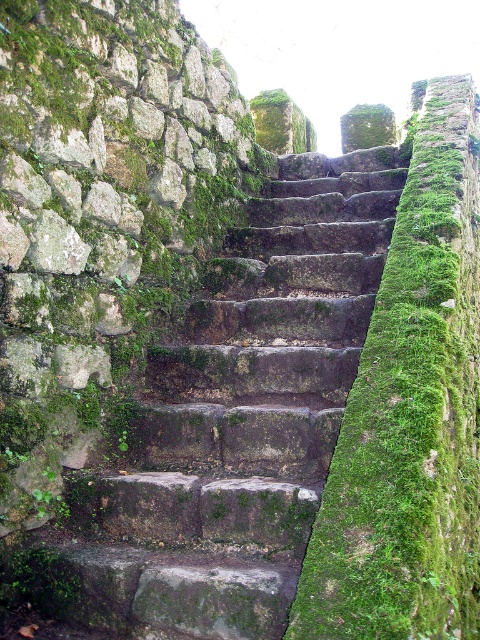
You are a painter who needs to paint both the rusty stone stairs at center and the green mossy wall at center. Which object requires more paint considering their widths?

The rusty stone stairs at center might be wider than green mossy wall at center, so they would require more paint.

You are a hiker carrying a heavy backpack and need to climb the stairs. Considering the height of the rusty stone stairs at center and the green mossy wall at center, which one is lower and thus easier to step onto?

The rusty stone stairs at center is shorter than the green mossy wall at center, so the stairs are lower and easier to step onto.

You are standing at the base of the staircase and want to reach the top. Given the coordinates of the rusty stone stairs at center, can you estimate how many steps you need to climb to reach the top?

A: The coordinates of the rusty stone stairs at center are at point (231, 422), but without additional information about the total height or number of steps, it is impossible to accurately estimate the number of steps needed to reach the top.